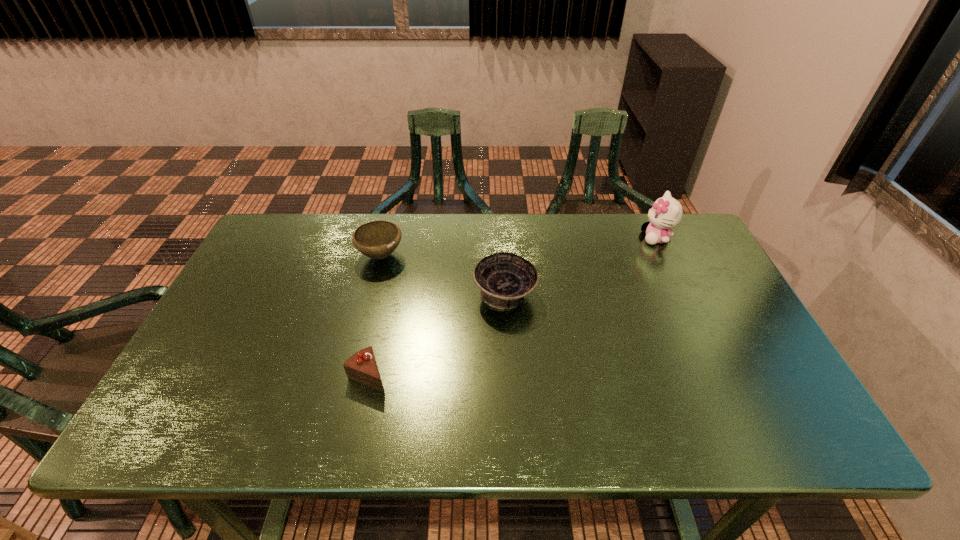
Find the location of `free spot located on the right of the farther bowl`. free spot located on the right of the farther bowl is located at coordinates (479, 255).

Identify the location of vacant area situated 0.100m on the left of the right bowl. (438, 295).

Identify the location of vacant area located 0.140m on the back of the shortest object. The image size is (960, 540). (381, 317).

Identify the location of kitten positioned at the far edge. (666, 213).

Find the location of a particular element. This screenshot has width=960, height=540. bowl at the far edge is located at coordinates (378, 239).

At what (x,y) coordinates should I click in order to perform the action: click on object located in the right edge section of the desktop. Please return your answer as a coordinate pair (x, y). Looking at the image, I should click on (666, 213).

The width and height of the screenshot is (960, 540). I want to click on object at the far right corner, so click(x=666, y=213).

In the image, there is a desktop. Where is `vacant space at the far edge`? The image size is (960, 540). vacant space at the far edge is located at coordinates (509, 213).

In the image, there is a desktop. Find the location of `vacant space at the near edge`. vacant space at the near edge is located at coordinates (386, 438).

The width and height of the screenshot is (960, 540). Find the location of `free space at the left edge of the desktop`. free space at the left edge of the desktop is located at coordinates (218, 309).